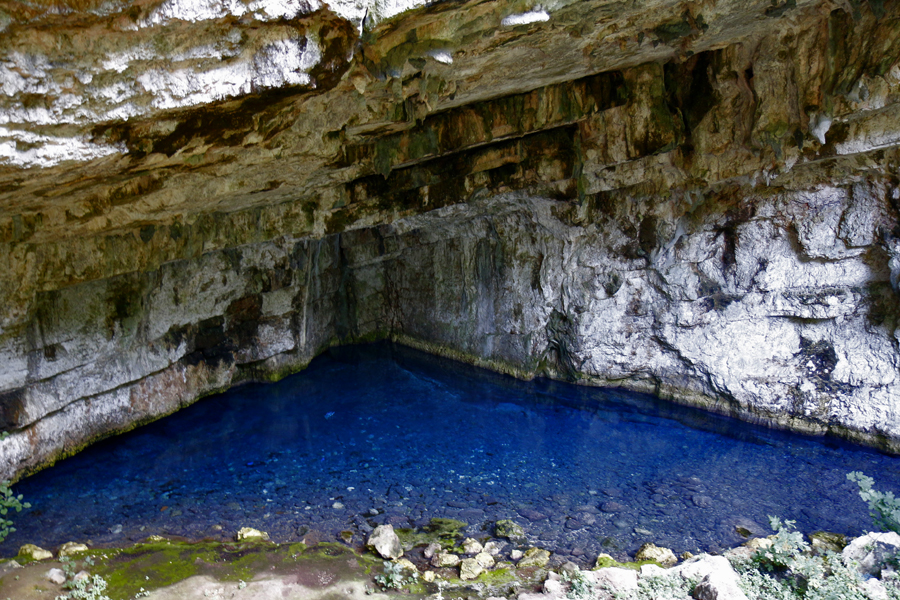
The width and height of the screenshot is (900, 600). I want to click on shelves, so click(x=542, y=147).